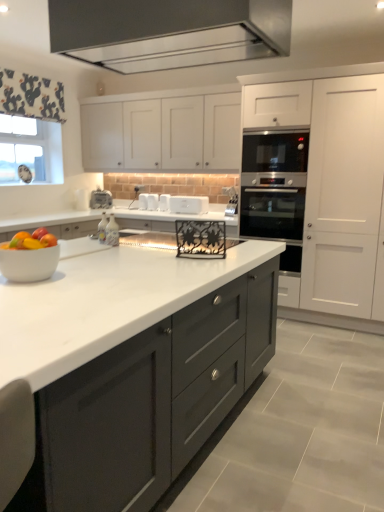
Question: From a real-world perspective, is satin silver oven at center-right physically located above or below white fabric at upper left?

Choices:
 (A) below
 (B) above

Answer: (A)

Question: Considering the positions of point (301, 176) and point (1, 81), is point (301, 176) closer or farther from the camera than point (1, 81)?

Choices:
 (A) closer
 (B) farther

Answer: (A)

Question: Which object is the farthest from the white matte cabinet at right, placed as the 2th cabinetry when sorted from left to right?

Choices:
 (A) satin metallic exhaust hood at upper center
 (B) white fabric at upper left
 (C) white plastic toaster at center, which appears as the second appliance when viewed from the left
 (D) white glossy toaster at center, the fourth appliance in the left-to-right sequence
 (E) shiny plastic bowl of mixed fruits at center-left

Answer: (B)

Question: Estimate the real-world distances between objects in this image. Which object is farther from the white matte toaster at center, arranged as the third appliance when viewed from the left?

Choices:
 (A) clear glass window screen at upper left
 (B) shiny plastic bowl of mixed fruits at center-left
 (C) satin silver oven at center-right
 (D) white matte cabinet at upper center, the second cabinetry from the right
 (E) white plastic toaster at center, which appears as the second appliance when viewed from the left

Answer: (B)